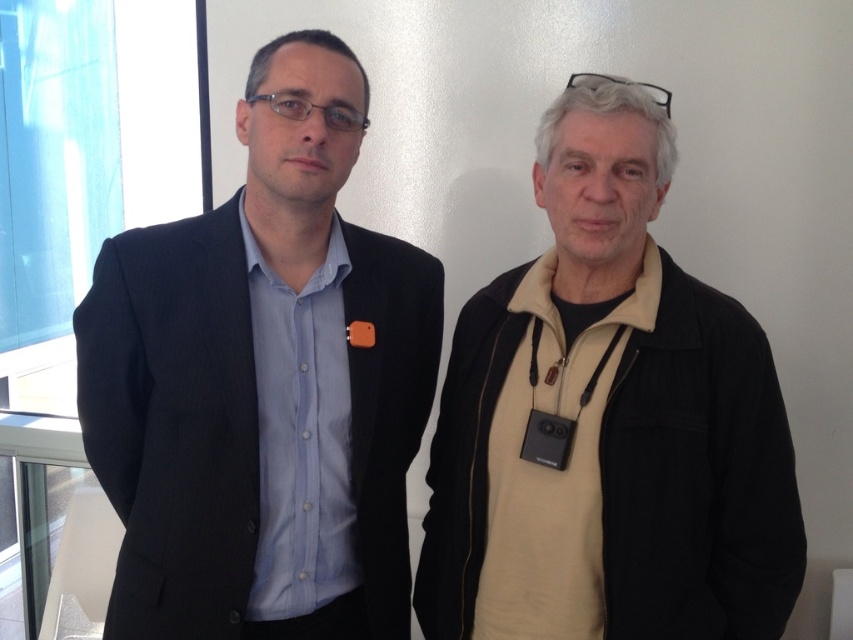
Is matte black suit at left positioned before beige fleece at right?

No, it is not.

What do you see at coordinates (263, 385) in the screenshot?
I see `matte black suit at left` at bounding box center [263, 385].

This screenshot has height=640, width=853. What are the coordinates of `matte black suit at left` in the screenshot? It's located at (263, 385).